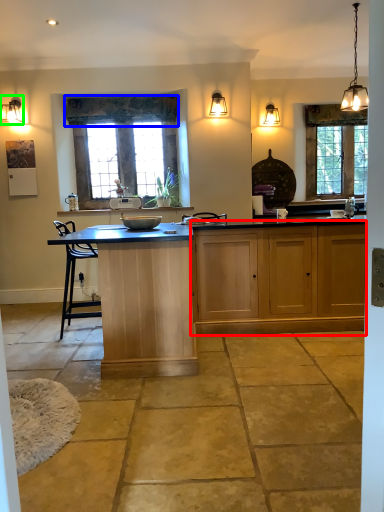
Question: Which object is positioned closest to cabinetry (highlighted by a red box)? Select from curtain (highlighted by a blue box) and lamp (highlighted by a green box).

Choices:
 (A) curtain
 (B) lamp

Answer: (A)